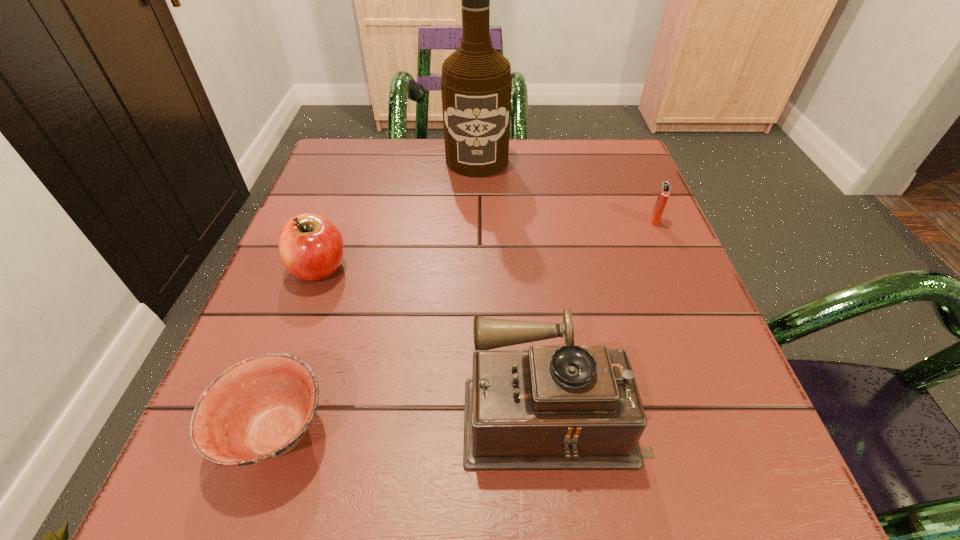
Find the location of `vacant area at the near right corner of the desktop`. vacant area at the near right corner of the desktop is located at coordinates (738, 503).

Image resolution: width=960 pixels, height=540 pixels. I want to click on vacant space that's between the apple and the rightmost object, so click(487, 245).

This screenshot has height=540, width=960. I want to click on free space that is in between the third nearest object and the igniter, so click(x=487, y=245).

Identify the location of free space between the bowl and the third tallest object. (298, 350).

At what (x,y) coordinates should I click in order to perform the action: click on vacant space in between the bowl and the third farthest object. Please return your answer as a coordinate pair (x, y). The width and height of the screenshot is (960, 540). Looking at the image, I should click on (298, 350).

You are a GUI agent. You are given a task and a screenshot of the screen. Output one action in this format:
    pyautogui.click(x=<x>, y=<y>)
    Task: Click on the free spot between the third shortest object and the phonograph_record
    
    Given the screenshot: What is the action you would take?
    pyautogui.click(x=436, y=337)

Where is `free space between the third nearest object and the bowl`? This screenshot has width=960, height=540. free space between the third nearest object and the bowl is located at coordinates (298, 350).

I want to click on free space between the bowl and the igniter, so click(x=466, y=327).

Where is `vacant area that lies between the farthest object and the bowl`? The image size is (960, 540). vacant area that lies between the farthest object and the bowl is located at coordinates (376, 296).

Image resolution: width=960 pixels, height=540 pixels. Find the location of `free space that is in between the third tallest object and the bowl`. free space that is in between the third tallest object and the bowl is located at coordinates (298, 350).